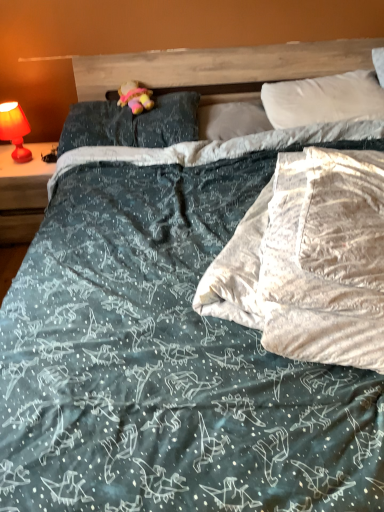
Question: Can you confirm if white soft pillow at upper right, marked as the 3th pillow in a left-to-right arrangement, is positioned to the right of matte red lamp at left?

Choices:
 (A) no
 (B) yes

Answer: (B)

Question: Can you confirm if white soft pillow at upper right, which is the 1th pillow in right-to-left order, is positioned to the left of matte red lamp at left?

Choices:
 (A) yes
 (B) no

Answer: (B)

Question: Considering the relative sizes of white soft pillow at upper right, marked as the 3th pillow in a left-to-right arrangement, and matte red lamp at left in the image provided, is white soft pillow at upper right, marked as the 3th pillow in a left-to-right arrangement, shorter than matte red lamp at left?

Choices:
 (A) yes
 (B) no

Answer: (A)

Question: Is white soft pillow at upper right, marked as the 3th pillow in a left-to-right arrangement, next to matte red lamp at left and touching it?

Choices:
 (A) yes
 (B) no

Answer: (B)

Question: Does white soft pillow at upper right, marked as the 3th pillow in a left-to-right arrangement, have a greater height compared to matte red lamp at left?

Choices:
 (A) no
 (B) yes

Answer: (A)

Question: In the image, is matte red lamp at left positioned in front of or behind dark blue fabric pillow at upper center, which ranks as the third pillow in right-to-left order?

Choices:
 (A) front
 (B) behind

Answer: (B)

Question: Would you say matte red lamp at left is inside or outside dark blue fabric pillow at upper center, arranged as the first pillow when viewed from the left?

Choices:
 (A) inside
 (B) outside

Answer: (B)

Question: In the image, is matte red lamp at left on the left side or the right side of dark blue fabric pillow at upper center, which ranks as the third pillow in right-to-left order?

Choices:
 (A) right
 (B) left

Answer: (B)

Question: Considering the positions of matte red lamp at left and dark blue fabric pillow at upper center, which ranks as the third pillow in right-to-left order, in the image, is matte red lamp at left taller or shorter than dark blue fabric pillow at upper center, which ranks as the third pillow in right-to-left order,?

Choices:
 (A) tall
 (B) short

Answer: (A)

Question: In terms of height, does white soft pillow at upper right, which is the 1th pillow in right-to-left order, look taller or shorter compared to matte red lamp at left?

Choices:
 (A) short
 (B) tall

Answer: (A)

Question: Considering the positions of point (350, 79) and point (26, 125), is point (350, 79) closer or farther from the camera than point (26, 125)?

Choices:
 (A) closer
 (B) farther

Answer: (A)

Question: Relative to matte red lamp at left, is white soft pillow at upper right, which is the 1th pillow in right-to-left order, in front or behind?

Choices:
 (A) front
 (B) behind

Answer: (A)

Question: Is white soft pillow at upper right, which is the 1th pillow in right-to-left order, inside the boundaries of matte red lamp at left, or outside?

Choices:
 (A) outside
 (B) inside

Answer: (A)

Question: From a real-world perspective, relative to white soft pillow at center, marked as the second pillow in a left-to-right arrangement, is pastel plush toy at center vertically above or below?

Choices:
 (A) below
 (B) above

Answer: (B)

Question: Which is correct: pastel plush toy at center is inside white soft pillow at center, which is the 2th pillow from right to left, or outside of it?

Choices:
 (A) outside
 (B) inside

Answer: (A)